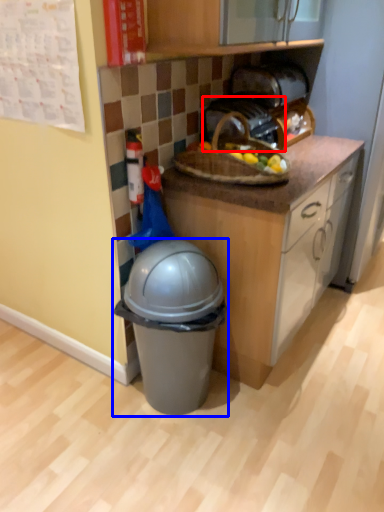
Question: Which object is further to the camera taking this photo, toaster (highlighted by a red box) or trash bin/can (highlighted by a blue box)?

Choices:
 (A) toaster
 (B) trash bin/can

Answer: (A)